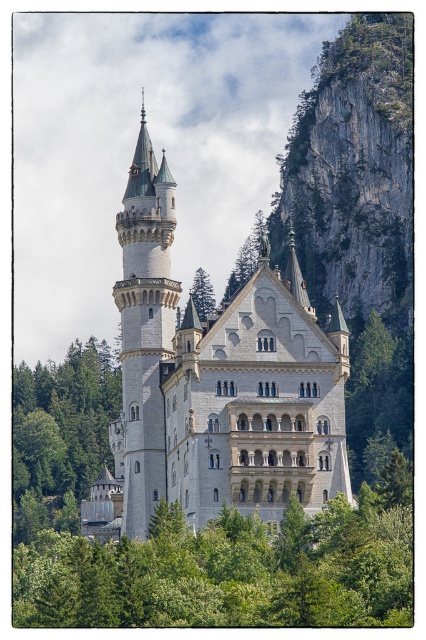
You are a landscape photographer planning to capture the castle with both the green leafy tree at lower left and the green leafy tree at right in the frame. Which tree should you position closer to the camera to ensure both are fully visible in the photo?

Position the green leafy tree at lower left closer to the camera because its width is larger than the green leafy tree at right. This way, both trees will fit within the frame without one being cropped out.